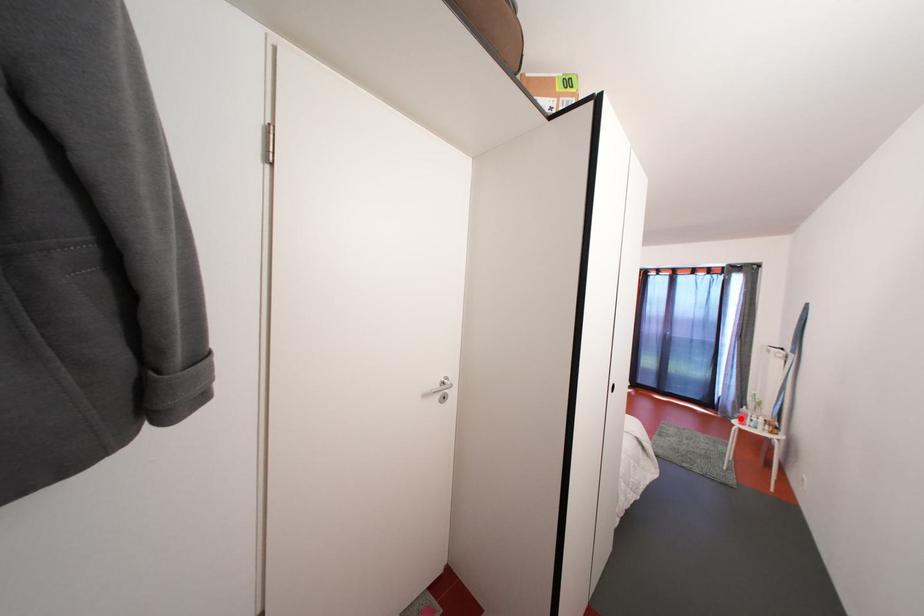
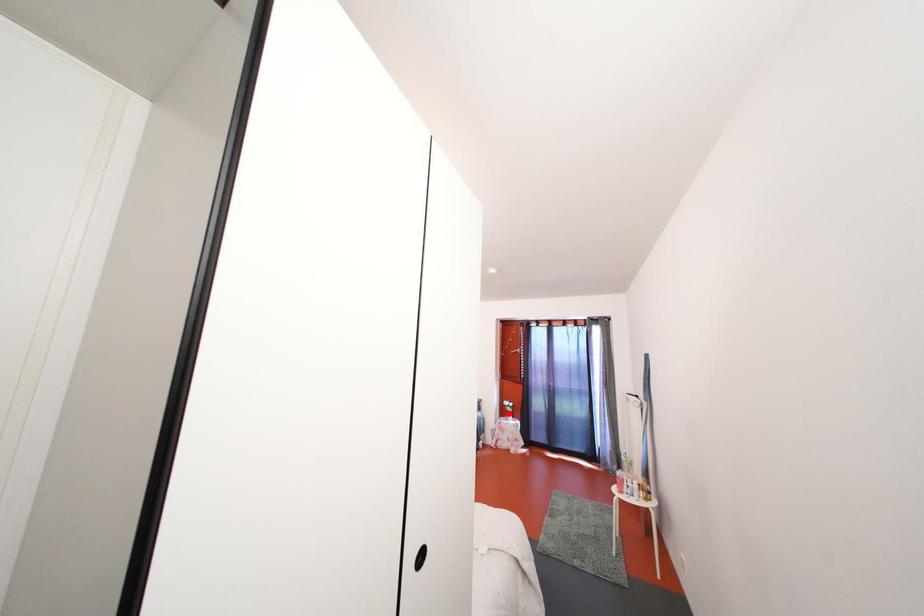
I am providing you with two images of the same scene from different viewpoints. A red point is marked on the first image and another point is marked on the second image. Are the points marked in image1 and image2 representing the same 3D position?

No